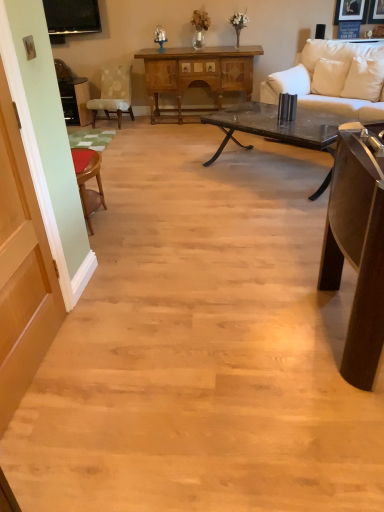
Find the location of a particular element. free location in front of transparent glass door at left is located at coordinates (59, 440).